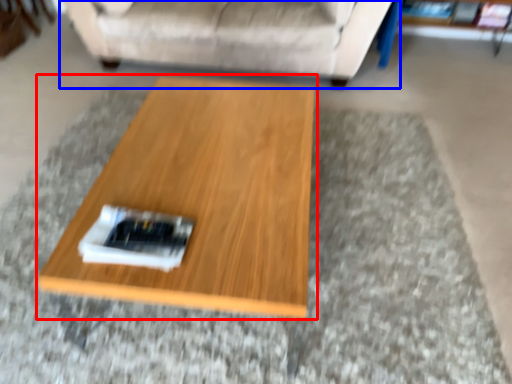
Question: Which of the following is the closest to the observer, coffee table (highlighted by a red box) or studio couch (highlighted by a blue box)?

Choices:
 (A) coffee table
 (B) studio couch

Answer: (A)